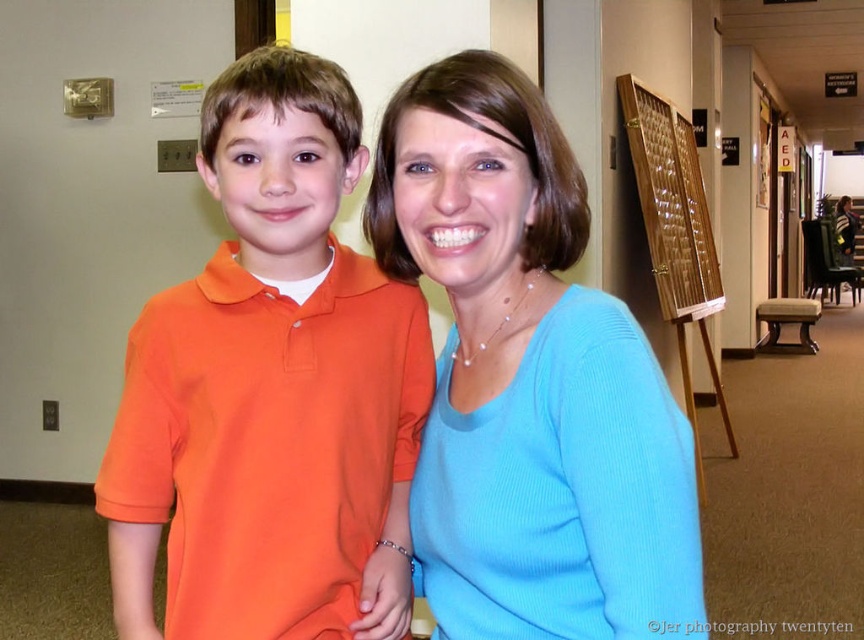
You are a delivery person with a box that is 3 meters long. You need to place the box between the blue knit sweater at center and the wooden textured board at right. Can you fit the box between them without bending it?

The blue knit sweater at center and wooden textured board at right are 3.13 meters apart from each other. Since the box is 3 meters long, it can fit between them as the distance is slightly longer than the box.

What are the coordinates of the blue knit sweater at center?

The blue knit sweater at center is located at coordinates point [529,381].

You are standing in the hallway and want to reach a point that is exactly at coordinates point (499, 468). If you are currently 30 inches away from that point, how many more inches do you need to move forward to reach it?

The distance of point (499, 468) from viewer is 31.60 inches. Since you are currently 30 inches away, you need to move forward 1.60 inches to reach it.